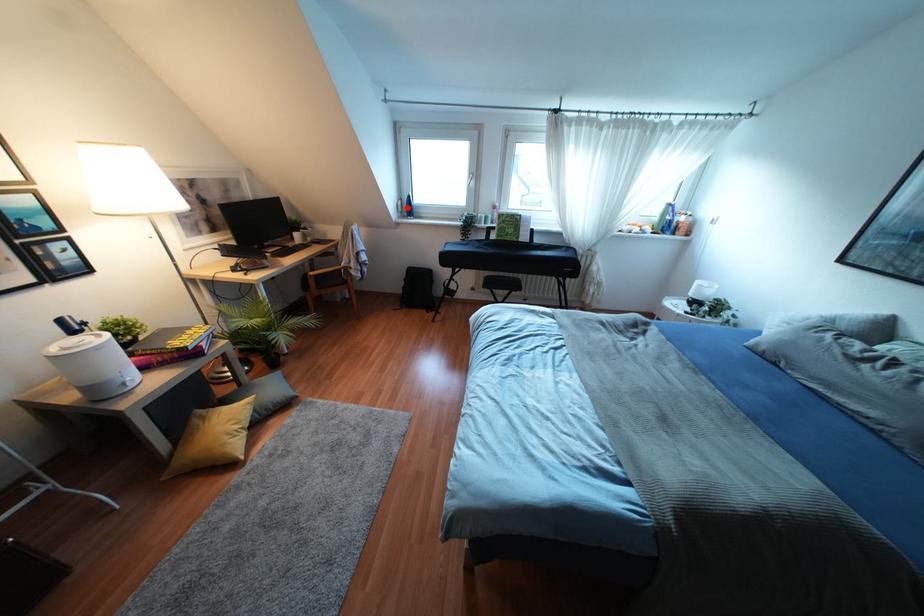
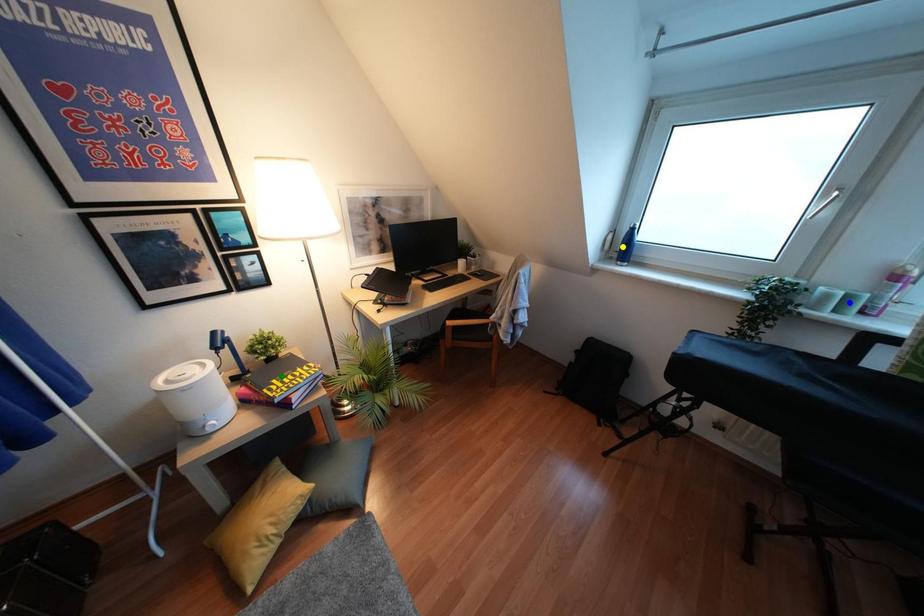
Question: I am providing you with two images of the same scene from different viewpoints. A red point is marked on the first image. You are given multiple points on the second image. Can you choose the point in image 2 that corresponds to the point in image 1?

Choices:
 (A) blue point
 (B) yellow point
 (C) green point

Answer: (B)